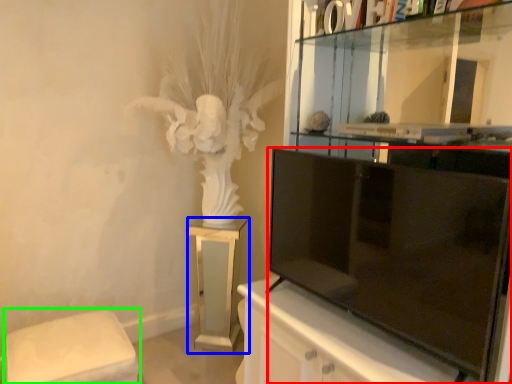
Question: Which object is positioned closest to television (highlighted by a red box)? Select from furniture (highlighted by a blue box) and furniture (highlighted by a green box).

Choices:
 (A) furniture
 (B) furniture

Answer: (A)